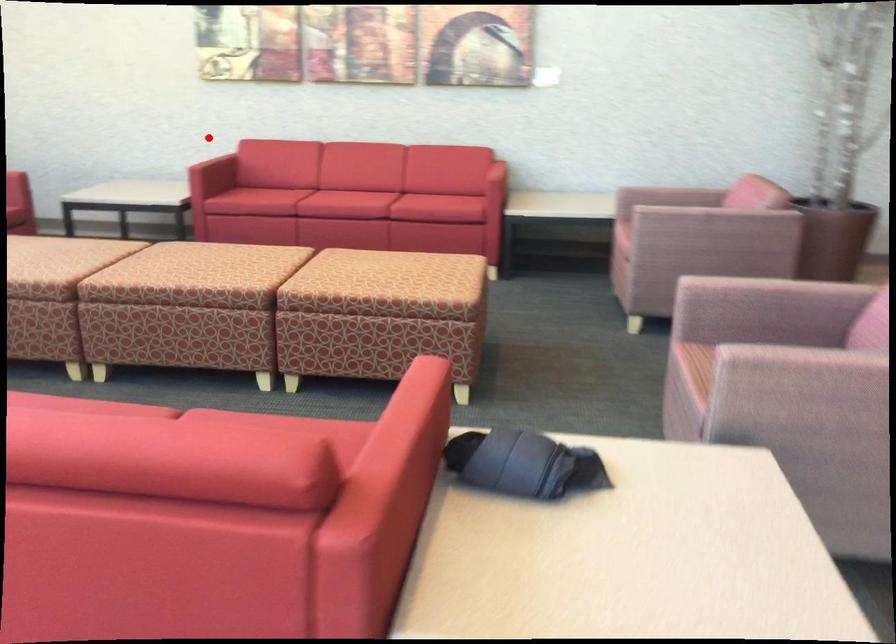
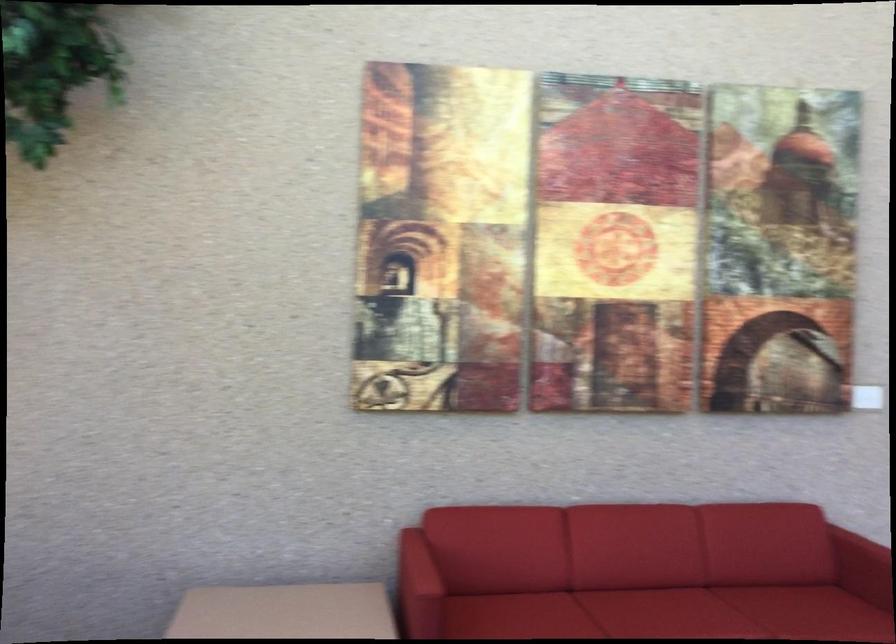
Question: I am providing you with two images of the same scene from different viewpoints. Image1 has a red point marked. In image2, the corresponding 3D location appears at what relative position? Reply with the corresponding letter.

Choices:
 (A) Closer
 (B) Farther

Answer: (A)